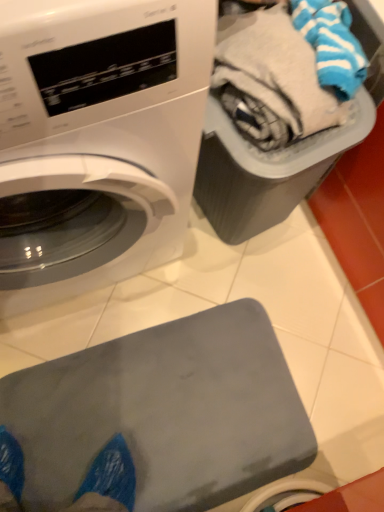
Question: Is gray rubber mat at lower center located outside plastic gray bin at upper right?

Choices:
 (A) yes
 (B) no

Answer: (A)

Question: Is the position of gray rubber mat at lower center less distant than that of plastic gray bin at upper right?

Choices:
 (A) yes
 (B) no

Answer: (B)

Question: From the image's perspective, is gray rubber mat at lower center over plastic gray bin at upper right?

Choices:
 (A) no
 (B) yes

Answer: (A)

Question: From a real-world perspective, is gray rubber mat at lower center located higher than plastic gray bin at upper right?

Choices:
 (A) yes
 (B) no

Answer: (B)

Question: Is gray rubber mat at lower center turned away from plastic gray bin at upper right?

Choices:
 (A) no
 (B) yes

Answer: (A)

Question: From the image's perspective, is white glossy washing machine at upper left located above or below gray rubber mat at lower center?

Choices:
 (A) below
 (B) above

Answer: (B)

Question: From a real-world perspective, is white glossy washing machine at upper left positioned above or below gray rubber mat at lower center?

Choices:
 (A) above
 (B) below

Answer: (A)

Question: Choose the correct answer: Is white glossy washing machine at upper left inside gray rubber mat at lower center or outside it?

Choices:
 (A) outside
 (B) inside

Answer: (A)

Question: Is white glossy washing machine at upper left wider or thinner than gray rubber mat at lower center?

Choices:
 (A) thin
 (B) wide

Answer: (A)

Question: Is gray rubber mat at lower center bigger or smaller than plastic gray bin at upper right?

Choices:
 (A) big
 (B) small

Answer: (B)

Question: Relative to plastic gray bin at upper right, is gray rubber mat at lower center in front or behind?

Choices:
 (A) front
 (B) behind

Answer: (B)

Question: Visually, is gray rubber mat at lower center positioned to the left or to the right of plastic gray bin at upper right?

Choices:
 (A) left
 (B) right

Answer: (A)

Question: In terms of width, does gray rubber mat at lower center look wider or thinner when compared to plastic gray bin at upper right?

Choices:
 (A) thin
 (B) wide

Answer: (B)

Question: From a real-world perspective, is gray rubber mat at lower center physically located above or below white glossy washing machine at upper left?

Choices:
 (A) below
 (B) above

Answer: (A)

Question: Which is correct: gray rubber mat at lower center is inside white glossy washing machine at upper left, or outside of it?

Choices:
 (A) inside
 (B) outside

Answer: (B)